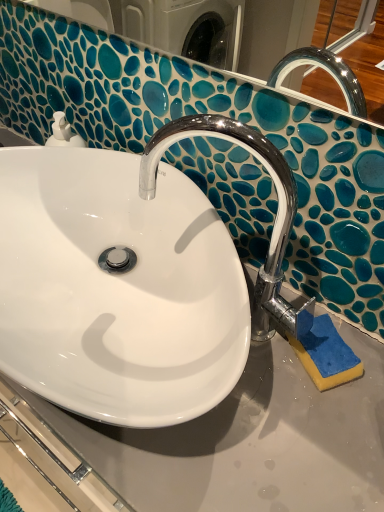
Question: Is blue sponge at lower right positioned behind chrome/metallic faucet at center?

Choices:
 (A) yes
 (B) no

Answer: (A)

Question: Could you tell me if blue sponge at lower right is facing chrome/metallic faucet at center?

Choices:
 (A) no
 (B) yes

Answer: (A)

Question: Can you confirm if blue sponge at lower right is positioned to the right of chrome/metallic faucet at center?

Choices:
 (A) no
 (B) yes

Answer: (B)

Question: Is blue sponge at lower right facing away from chrome/metallic faucet at center?

Choices:
 (A) no
 (B) yes

Answer: (A)

Question: Is blue sponge at lower right beside chrome/metallic faucet at center?

Choices:
 (A) yes
 (B) no

Answer: (B)

Question: Is white glossy sink at center inside the boundaries of blue sponge at lower right, or outside?

Choices:
 (A) outside
 (B) inside

Answer: (A)

Question: Does point (145, 306) appear closer or farther from the camera than point (317, 384)?

Choices:
 (A) farther
 (B) closer

Answer: (A)

Question: Considering their positions, is white glossy sink at center located in front of or behind blue sponge at lower right?

Choices:
 (A) behind
 (B) front

Answer: (B)

Question: Would you say white glossy sink at center is to the left or to the right of blue sponge at lower right in the picture?

Choices:
 (A) left
 (B) right

Answer: (A)

Question: Based on their positions, is blue sponge at lower right located to the left or right of chrome/metallic faucet at center?

Choices:
 (A) left
 (B) right

Answer: (B)

Question: From the image's perspective, relative to chrome/metallic faucet at center, is blue sponge at lower right above or below?

Choices:
 (A) below
 (B) above

Answer: (A)

Question: Is blue sponge at lower right wider or thinner than chrome/metallic faucet at center?

Choices:
 (A) wide
 (B) thin

Answer: (B)

Question: Is blue sponge at lower right situated inside chrome/metallic faucet at center or outside?

Choices:
 (A) inside
 (B) outside

Answer: (B)

Question: Is blue sponge at lower right inside or outside of white glossy sink at center?

Choices:
 (A) inside
 (B) outside

Answer: (B)

Question: Considering the positions of blue sponge at lower right and white glossy sink at center in the image, is blue sponge at lower right wider or thinner than white glossy sink at center?

Choices:
 (A) wide
 (B) thin

Answer: (B)